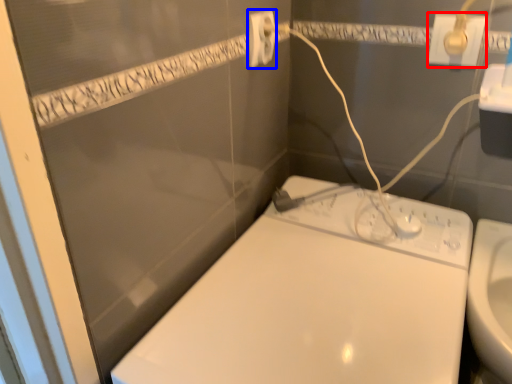
Question: Which of the following is the closest to the observer, power plugs and sockets (highlighted by a red box) or power plugs and sockets (highlighted by a blue box)?

Choices:
 (A) power plugs and sockets
 (B) power plugs and sockets

Answer: (B)